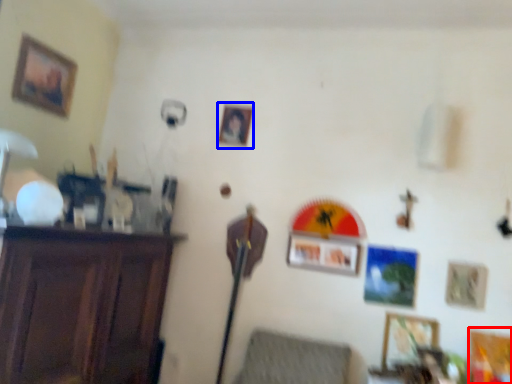
Question: Which of the following is the farthest to the observer, picture frame (highlighted by a red box) or picture frame (highlighted by a blue box)?

Choices:
 (A) picture frame
 (B) picture frame

Answer: (B)